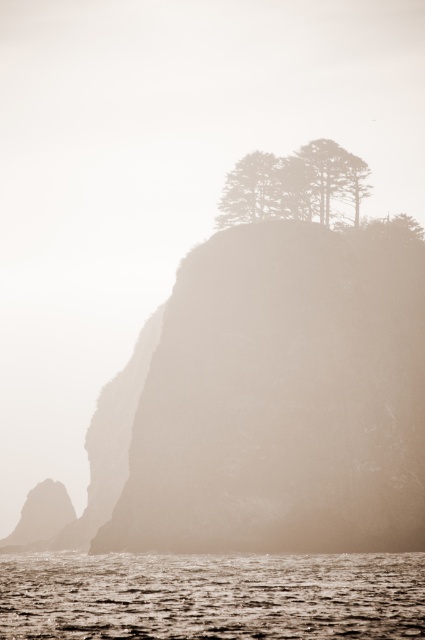
Is point (280, 433) behind point (158, 621)?

Yes, it is.

Where is `smooth beige cliff at center`? Image resolution: width=425 pixels, height=640 pixels. smooth beige cliff at center is located at coordinates (283, 397).

Identify the location of smooth beige cliff at center. Image resolution: width=425 pixels, height=640 pixels. tap(283, 397).

Can you confirm if smooth beige cliff at center is positioned below green textured tree at upper center?

Indeed, smooth beige cliff at center is positioned under green textured tree at upper center.

Is smooth beige cliff at center shorter than green textured tree at upper center?

Incorrect, smooth beige cliff at center's height does not fall short of green textured tree at upper center's.

Find the location of a particular element. The image size is (425, 640). smooth beige cliff at center is located at coordinates (283, 397).

What do you see at coordinates (283, 397) in the screenshot?
I see `smooth beige cliff at center` at bounding box center [283, 397].

Can you confirm if smooth beige cliff at center is positioned to the right of silhouetted trees at upper center?

No, smooth beige cliff at center is not to the right of silhouetted trees at upper center.

Locate an element on the screen. Image resolution: width=425 pixels, height=640 pixels. smooth beige cliff at center is located at coordinates (283, 397).